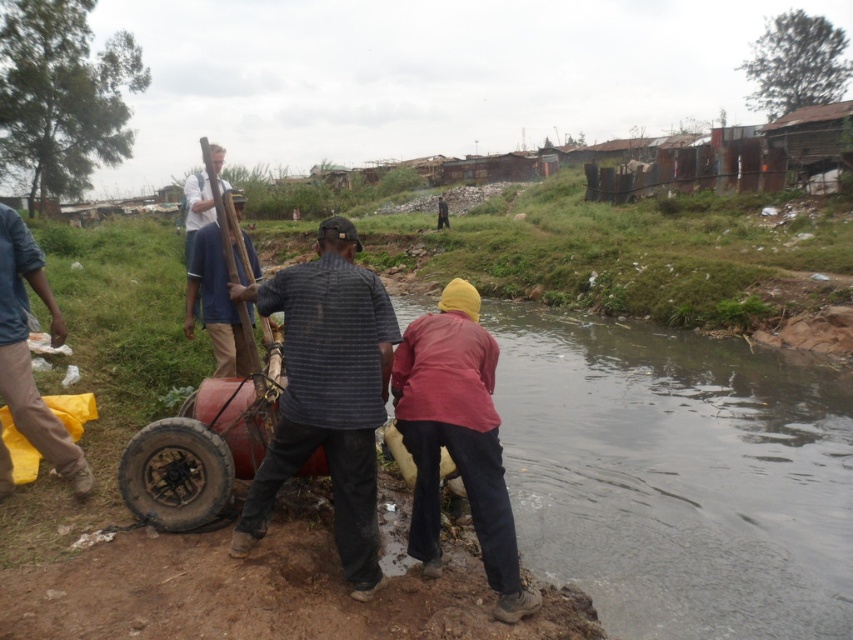
You are standing in the scene and want to pick up the white matte shirt at upper center. However, there is a dirty rubber tire at lower left in your way. Can you reach the shirt without moving the tire?

The dirty rubber tire at lower left is closer to the viewer than the white matte shirt at upper center. Therefore, you cannot reach the white matte shirt at upper center without moving the dirty rubber tire at lower left because it is blocking your path.

You are a photographer standing near the waterway and want to take a photo that includes both the red matte shirt at lower center and the blue fabric shirt at center. Based on their positions, which shirt should appear closer to the camera in the photo?

The red matte shirt at lower center should appear closer to the camera because it is positioned in front of the blue fabric shirt at center.

From the picture: You are a delivery person who needs to deliver a package to the red motorized device being pushed by the man in the striped shirt. The delivery area is marked by the point at coordinates point (x=175, y=474). Is the red motorized device located to the left or right of this delivery point?

The point (x=175, y=474) corresponds to the dirty rubber tire at lower left, so the red motorized device being pushed by the man in the striped shirt is to the right of the delivery point.